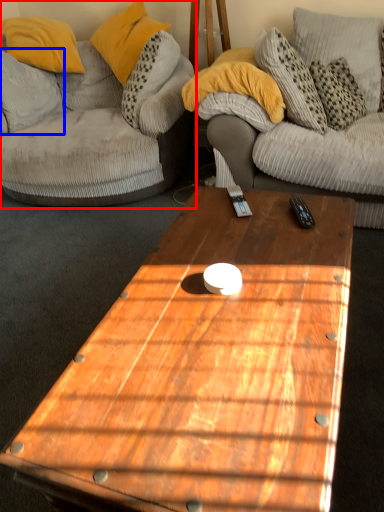
Question: Which of the following is the closest to the observer, studio couch (highlighted by a red box) or pillow (highlighted by a blue box)?

Choices:
 (A) studio couch
 (B) pillow

Answer: (A)